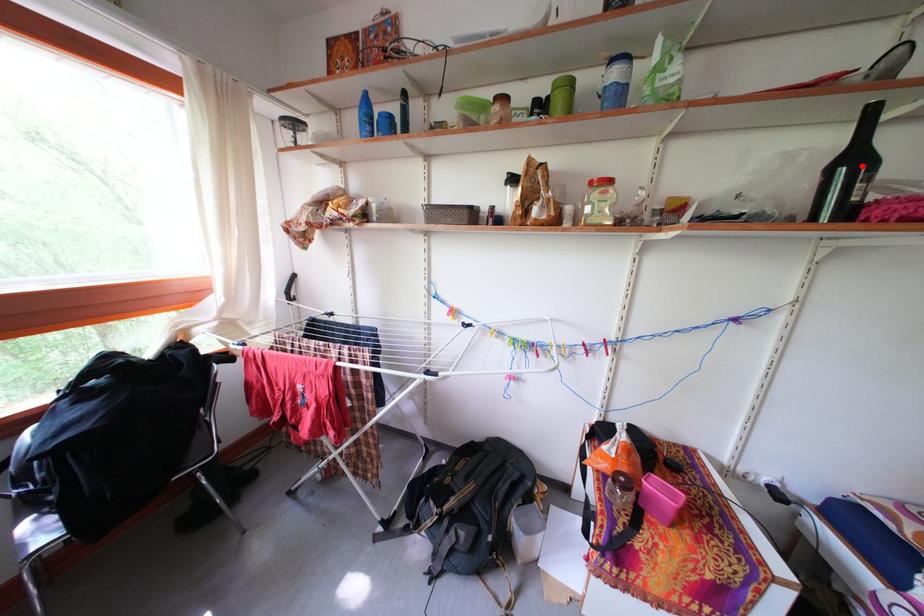
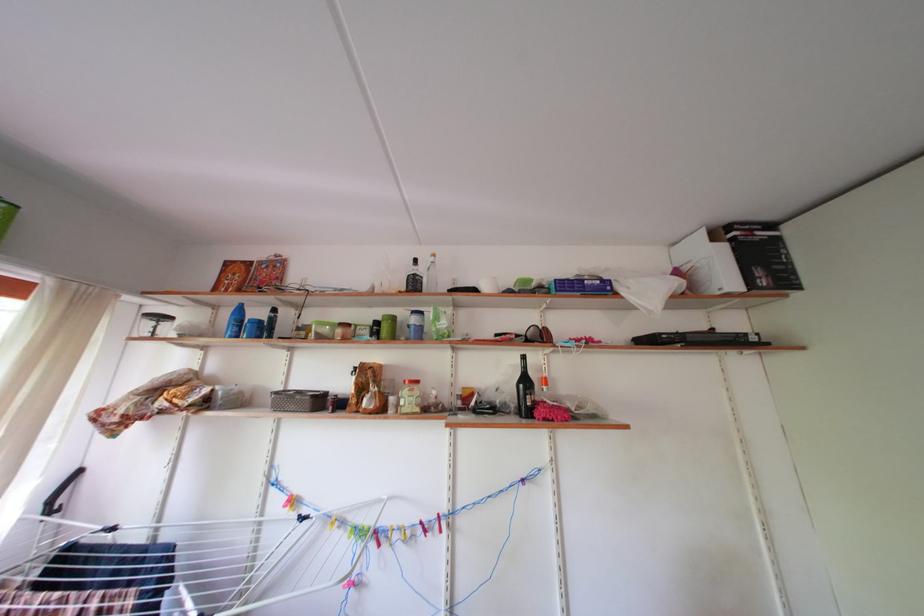
Where in the second image is the point corresponding to the highlighted location from the first image?

(533, 387)